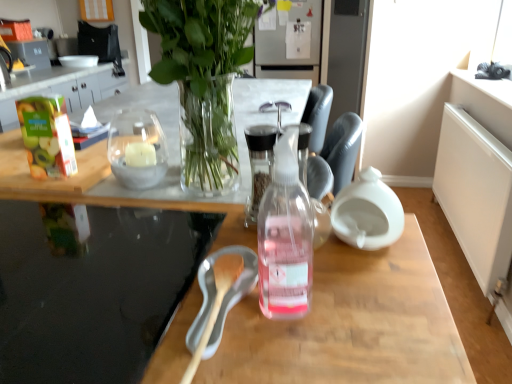
Question: Considering the positions of transparent plastic bottle at center and clear glass candle at center in the image, is transparent plastic bottle at center wider or thinner than clear glass candle at center?

Choices:
 (A) thin
 (B) wide

Answer: (B)

Question: Considering the positions of point (362, 264) and point (141, 117), is point (362, 264) closer or farther from the camera than point (141, 117)?

Choices:
 (A) closer
 (B) farther

Answer: (A)

Question: Based on their relative distances, which object is nearer to the clear glass candle at center?

Choices:
 (A) clear glass bottle at center
 (B) transparent glass table at lower left
 (C) transparent plastic bottle at center
 (D) clear glass vase at upper center
 (E) green matte apple juice at left

Answer: (E)

Question: Estimate the real-world distances between objects in this image. Which object is farther from the transparent glass table at lower left?

Choices:
 (A) clear glass bottle at center
 (B) clear glass vase at upper center
 (C) clear glass candle at center
 (D) transparent plastic bottle at center
 (E) green matte apple juice at left

Answer: (C)